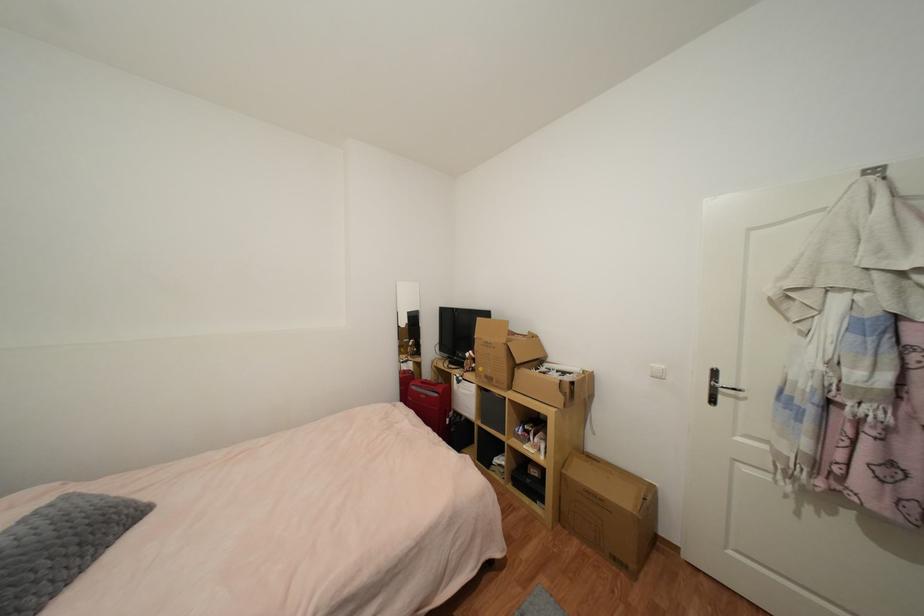
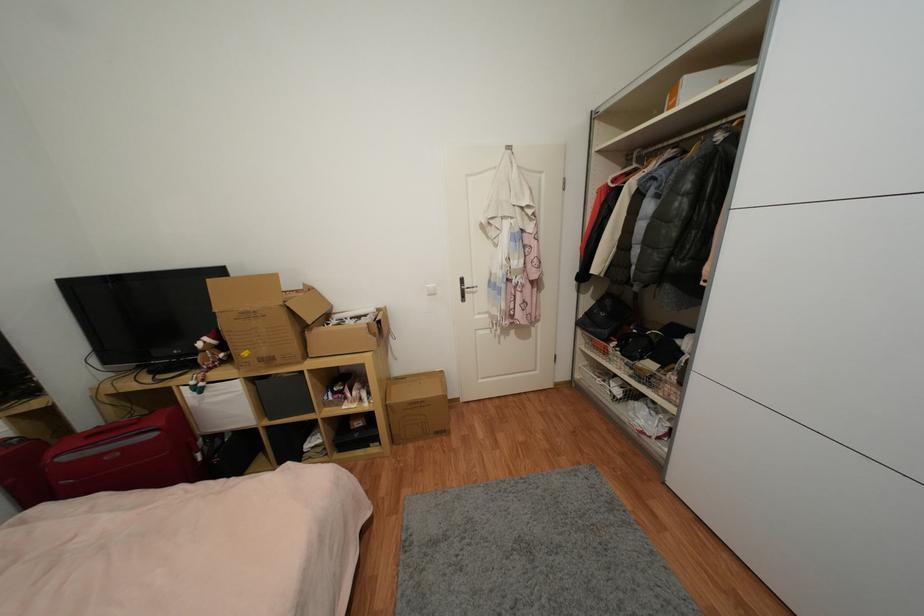
In the second image, find the point that corresponds to (465,379) in the first image.

(205, 386)